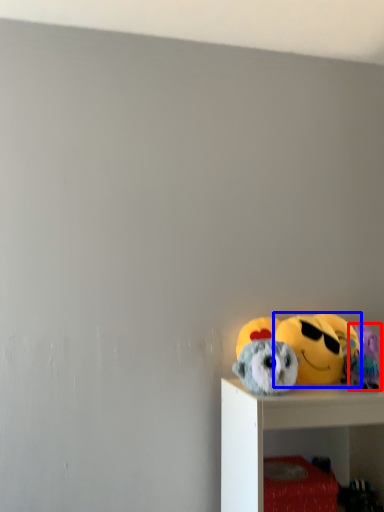
Question: Which of the following is the closest to the observer, toy (highlighted by a red box) or toy (highlighted by a blue box)?

Choices:
 (A) toy
 (B) toy

Answer: (A)